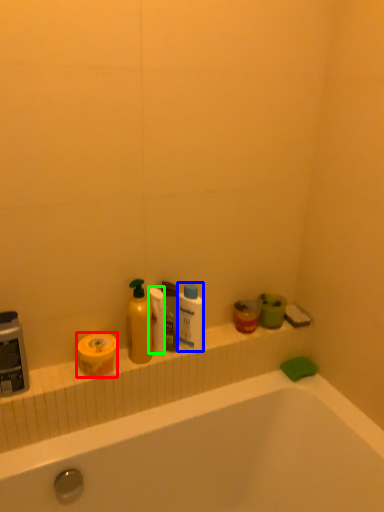
Question: Which object is the farthest from mouthwash (highlighted by a red box)? Choose among these: cleaning product (highlighted by a blue box) or toilet paper (highlighted by a green box).

Choices:
 (A) cleaning product
 (B) toilet paper

Answer: (A)